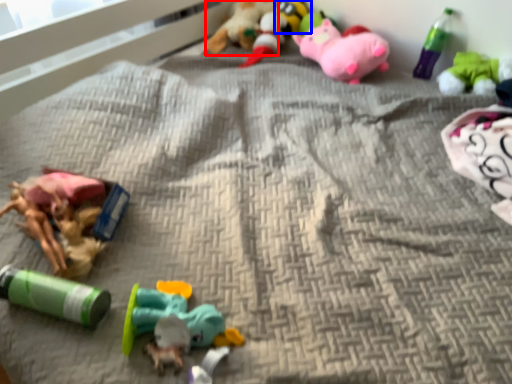
Question: Which point is further to the camera, toy (highlighted by a red box) or toy (highlighted by a blue box)?

Choices:
 (A) toy
 (B) toy

Answer: (B)